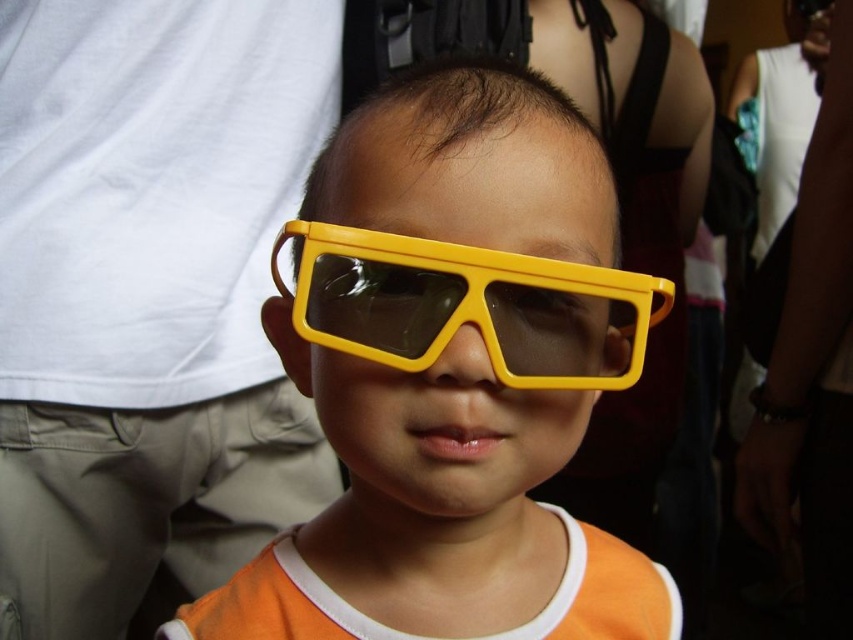
Is yellow plastic glasses at center to the left of yellow plastic goggles at center from the viewer's perspective?

Correct, you'll find yellow plastic glasses at center to the left of yellow plastic goggles at center.

Is yellow plastic glasses at center behind yellow plastic goggles at center?

No, it is in front of yellow plastic goggles at center.

This screenshot has height=640, width=853. What do you see at coordinates (451, 376) in the screenshot?
I see `yellow plastic glasses at center` at bounding box center [451, 376].

Where is `yellow plastic glasses at center`? This screenshot has height=640, width=853. yellow plastic glasses at center is located at coordinates (451, 376).